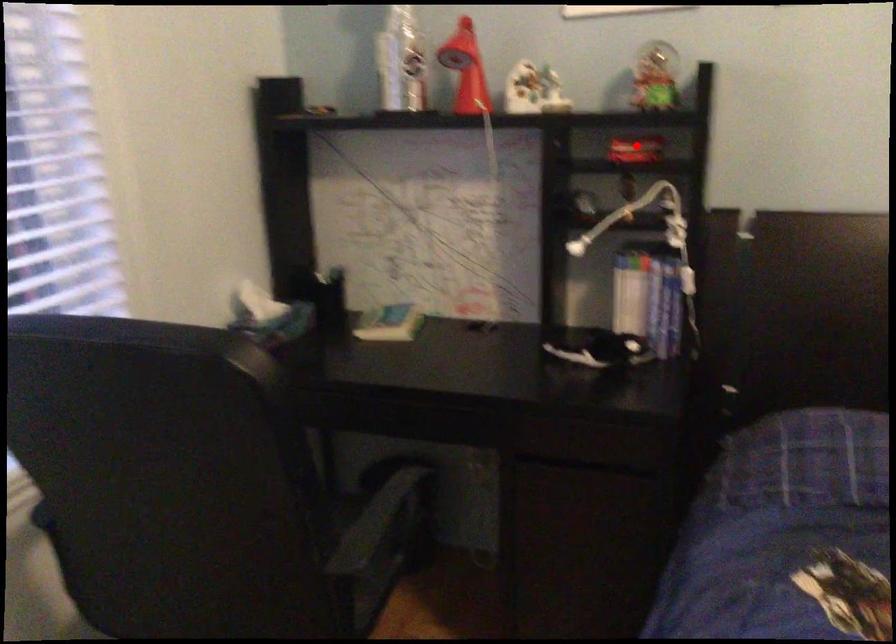
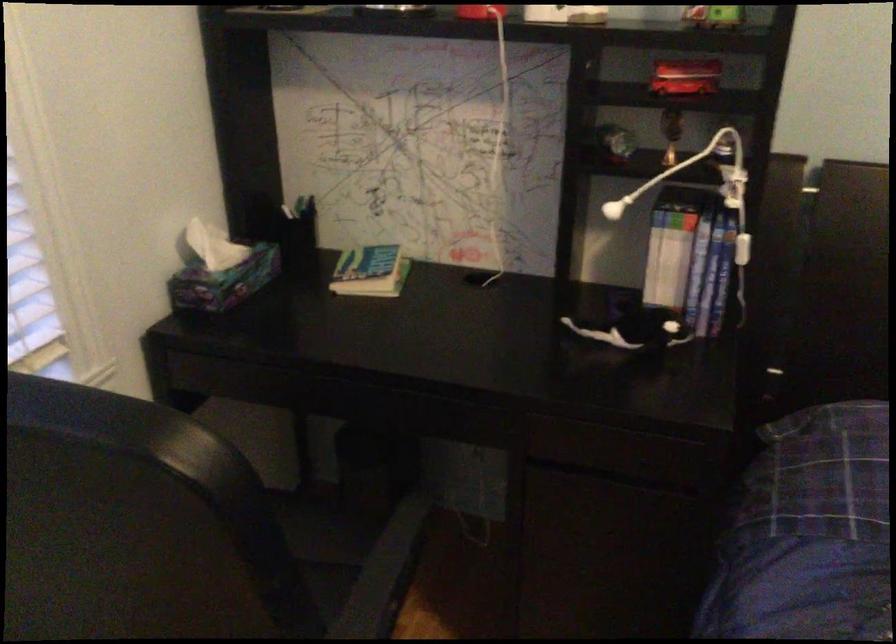
Question: I am providing you with two images of the same scene from different viewpoints. Given a red point in image1, look at the same physical point in image2. Is it:

Choices:
 (A) Closer to the viewpoint
 (B) Farther from the viewpoint

Answer: (A)